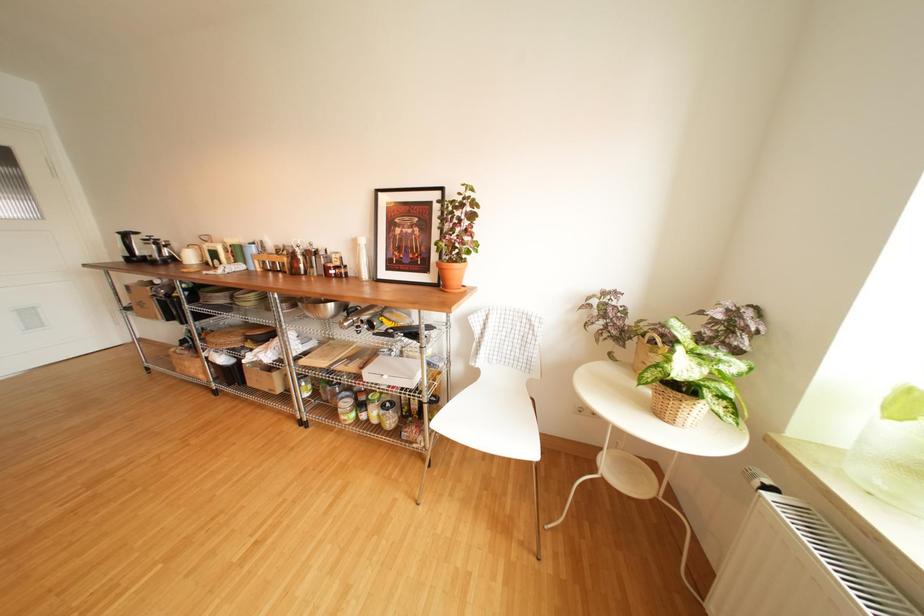
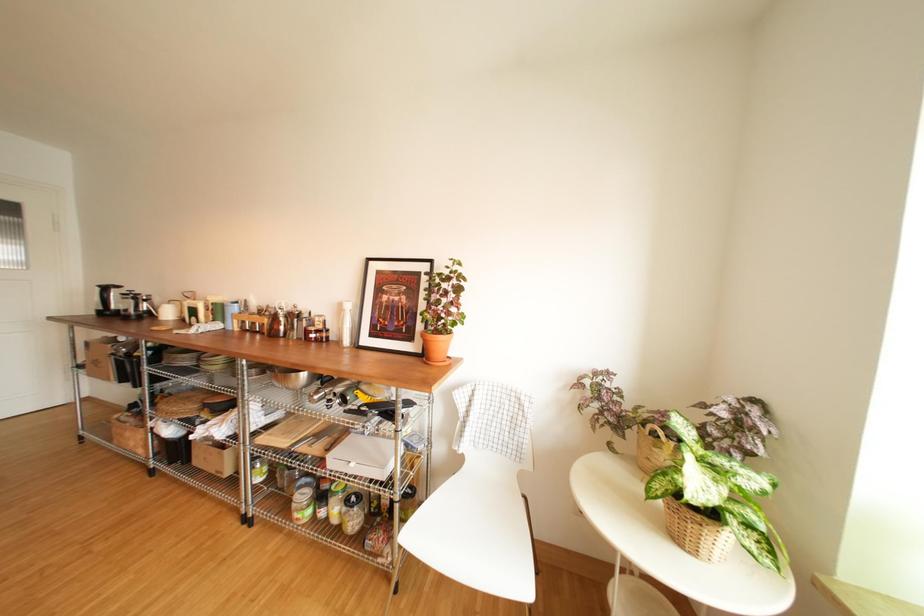
Which direction would the cameraman need to move to produce the second image?

The movement direction of the cameraman is right, forward.